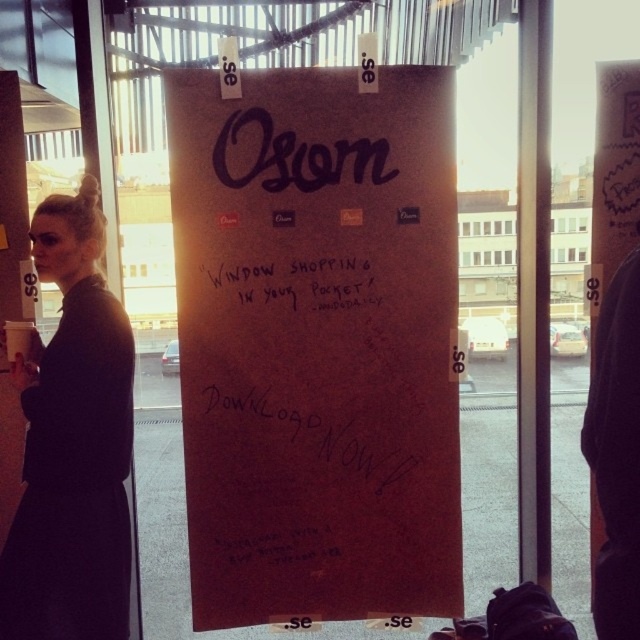
Can you confirm if black fabric at right is positioned to the left of black paper at center?

In fact, black fabric at right is to the right of black paper at center.

Does black fabric at right have a greater height compared to black paper at center?

Yes, black fabric at right is taller than black paper at center.

Identify the location of black fabric at right. This screenshot has height=640, width=640. (616, 452).

Image resolution: width=640 pixels, height=640 pixels. Describe the element at coordinates (72, 444) in the screenshot. I see `dark gray coat at left` at that location.

Identify the location of dark gray coat at left. This screenshot has width=640, height=640. (72, 444).

This screenshot has height=640, width=640. What are the coordinates of `dark gray coat at left` in the screenshot? It's located at (72, 444).

Describe the element at coordinates (72, 444) in the screenshot. The height and width of the screenshot is (640, 640). I see `dark gray coat at left` at that location.

Measure the distance between dark gray coat at left and camera.

A distance of 5.60 feet exists between dark gray coat at left and camera.

Does point (61, 388) lie behind point (634, 480)?

Yes, it is behind point (634, 480).

Image resolution: width=640 pixels, height=640 pixels. What are the coordinates of `dark gray coat at left` in the screenshot? It's located at (72, 444).